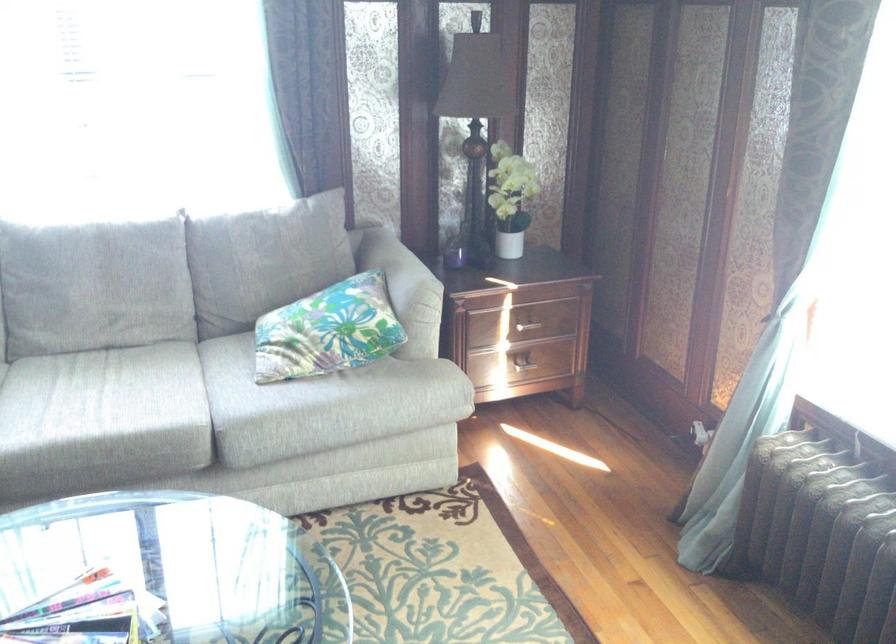
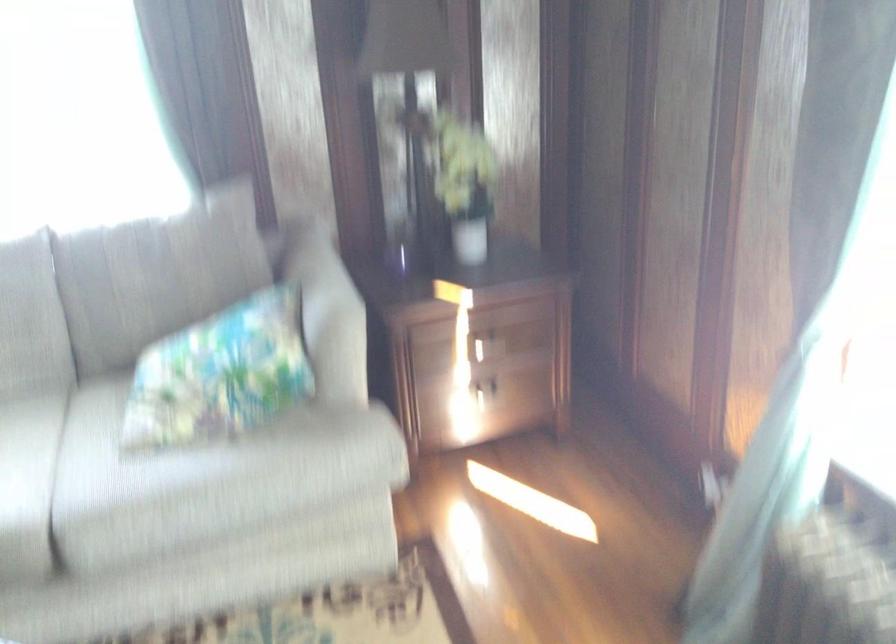
In the second image, find the point that corresponds to the point at 328,328 in the first image.

(220, 374)